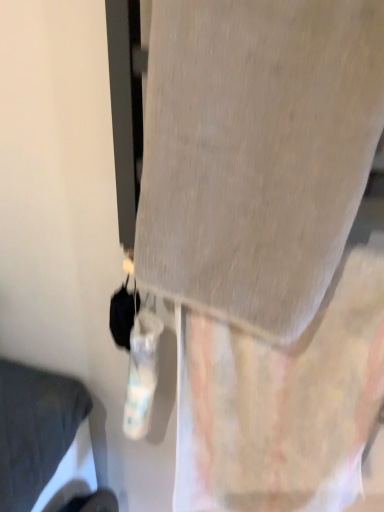
Question: Could you tell me if gray fabric at center is facing textured beige curtain at center?

Choices:
 (A) yes
 (B) no

Answer: (B)

Question: From the image's perspective, is gray fabric at center located beneath textured beige curtain at center?

Choices:
 (A) yes
 (B) no

Answer: (B)

Question: Is gray fabric at center closer to camera compared to textured beige curtain at center?

Choices:
 (A) no
 (B) yes

Answer: (B)

Question: Considering the relative sizes of gray fabric at center and textured beige curtain at center in the image provided, is gray fabric at center taller than textured beige curtain at center?

Choices:
 (A) no
 (B) yes

Answer: (A)

Question: Is gray fabric at center further to the viewer compared to textured beige curtain at center?

Choices:
 (A) yes
 (B) no

Answer: (B)

Question: Is gray fabric at center next to textured beige curtain at center and touching it?

Choices:
 (A) no
 (B) yes

Answer: (A)

Question: Considering the relative sizes of matte gray pillow at lower left and textured beige curtain at center in the image provided, is matte gray pillow at lower left wider than textured beige curtain at center?

Choices:
 (A) yes
 (B) no

Answer: (A)

Question: From a real-world perspective, does matte gray pillow at lower left stand above textured beige curtain at center?

Choices:
 (A) yes
 (B) no

Answer: (B)

Question: Could you tell me if matte gray pillow at lower left is turned towards textured beige curtain at center?

Choices:
 (A) no
 (B) yes

Answer: (B)

Question: Can you confirm if matte gray pillow at lower left is positioned to the right of textured beige curtain at center?

Choices:
 (A) no
 (B) yes

Answer: (A)

Question: Does matte gray pillow at lower left have a lesser height compared to textured beige curtain at center?

Choices:
 (A) yes
 (B) no

Answer: (B)

Question: Does matte gray pillow at lower left lie in front of textured beige curtain at center?

Choices:
 (A) no
 (B) yes

Answer: (A)

Question: Does textured beige curtain at center have a larger size compared to matte gray pillow at lower left?

Choices:
 (A) no
 (B) yes

Answer: (A)